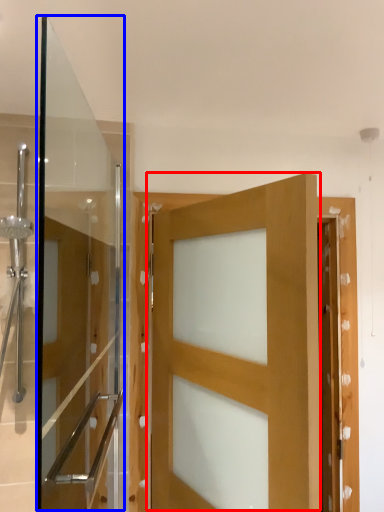
Question: Which object appears closest to the camera in this image, door (highlighted by a red box) or screen door (highlighted by a blue box)?

Choices:
 (A) door
 (B) screen door

Answer: (B)